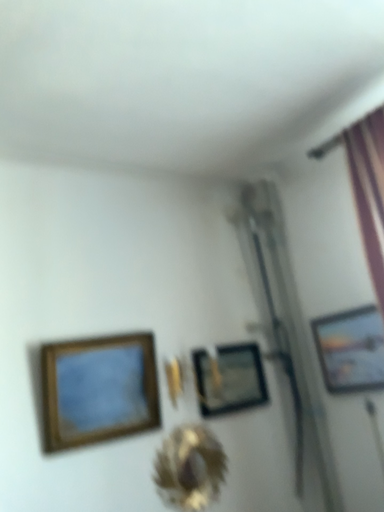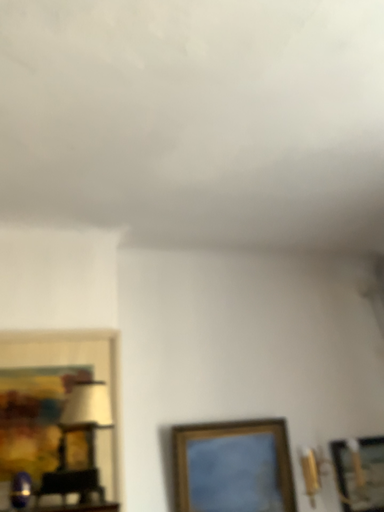
Question: How did the camera likely rotate when shooting the video?

Choices:
 (A) rotated downward
 (B) rotated upward

Answer: (B)